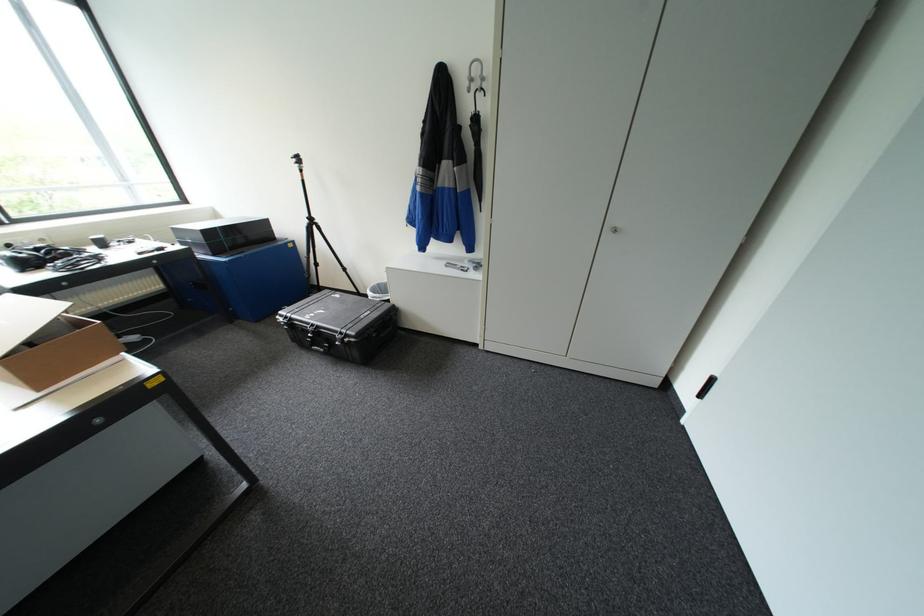
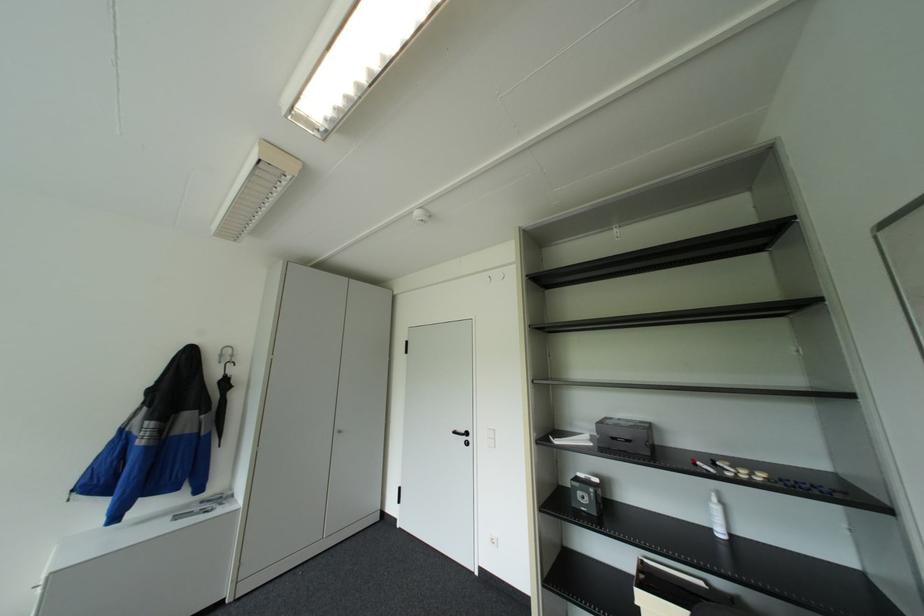
The point at [477,90] is marked in the first image. Where is the corresponding point in the second image?

(227, 361)